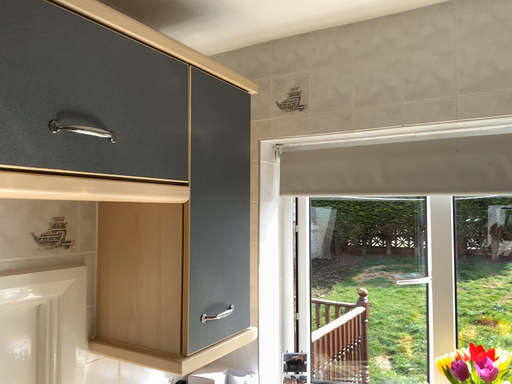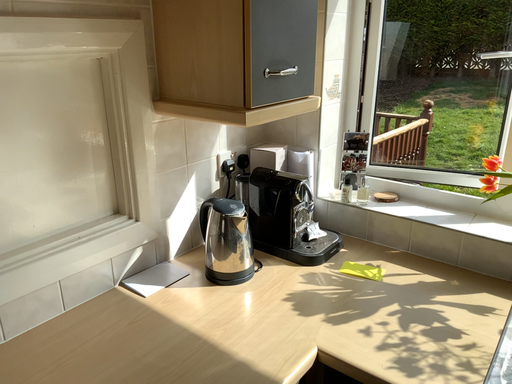
Question: Which way did the camera rotate in the video?

Choices:
 (A) rotated right
 (B) rotated left

Answer: (B)